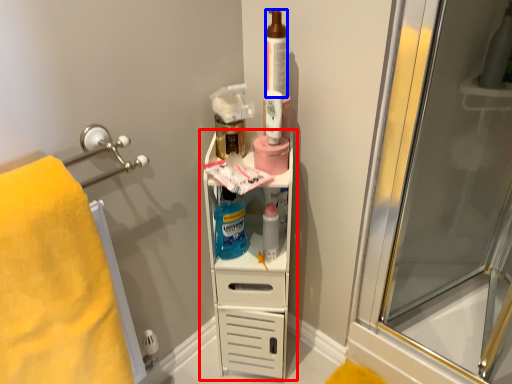
Question: Which of the following is the farthest to the observer, shelf (highlighted by a red box) or toiletry (highlighted by a blue box)?

Choices:
 (A) shelf
 (B) toiletry

Answer: (A)